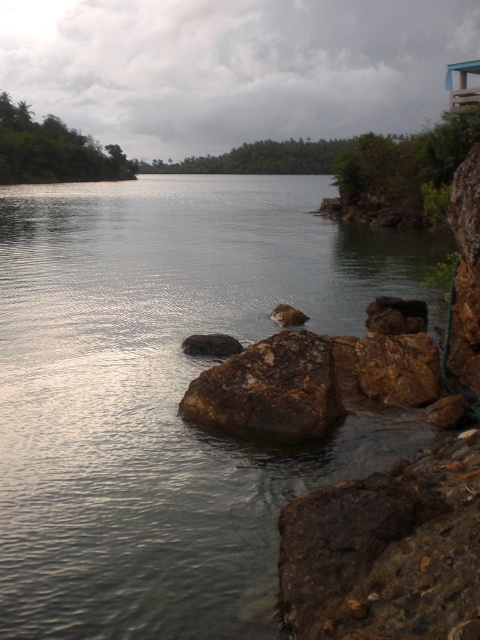
From the picture: You are a geologist examining the rocks at the lakeside. You have two rocks to compare in front of you, the rusty rock at center and the brown rough rock at center. Which one has a greater height?

The rusty rock at center is taller than the brown rough rock at center.

You are a hiker carrying a backpack that is 2 meters wide. You want to walk between the rusty rock at center and the rusty metallic rock at center. Is there enough space for your backpack to fit through the gap between them?

The distance between the rusty rock at center and the rusty metallic rock at center is 3.62 meters. Since your backpack is 2 meters wide, there is sufficient space for it to fit through the gap between them.